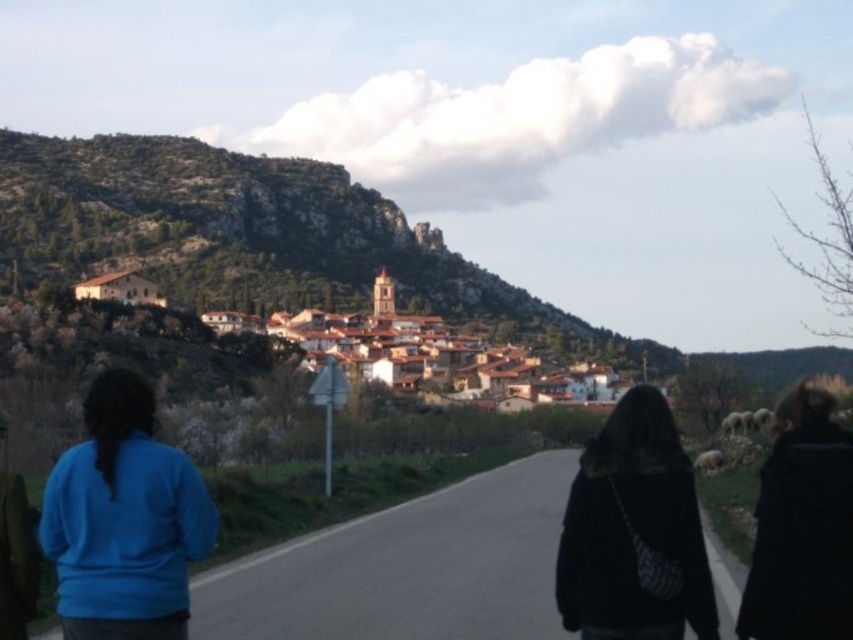
You are standing at the center of the village square and see the blue fleece jacket at lower left. If you walk straight towards the jacket, will you first encounter the church bell tower or the jacket?

The blue fleece jacket at lower left is located at point (125, 518), so walking straight towards it would lead you to the jacket before reaching the church bell tower.

You are a hiker planning to take the road leading away from the village towards the mountains. You notice two people wearing the blue fleece jacket at lower left and the black fuzzy coat at lower right. Which person is wearing a taller jacket?

Result: The blue fleece jacket at lower left is taller than the black fuzzy coat at lower right.